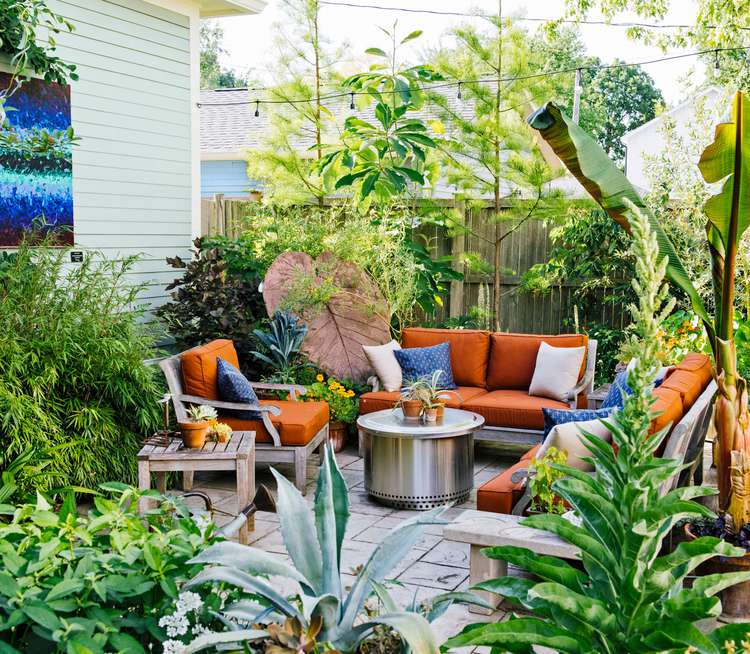
The width and height of the screenshot is (750, 654). In order to click on blue pillows with white stars in this screenshot , I will do `click(236, 388)`.